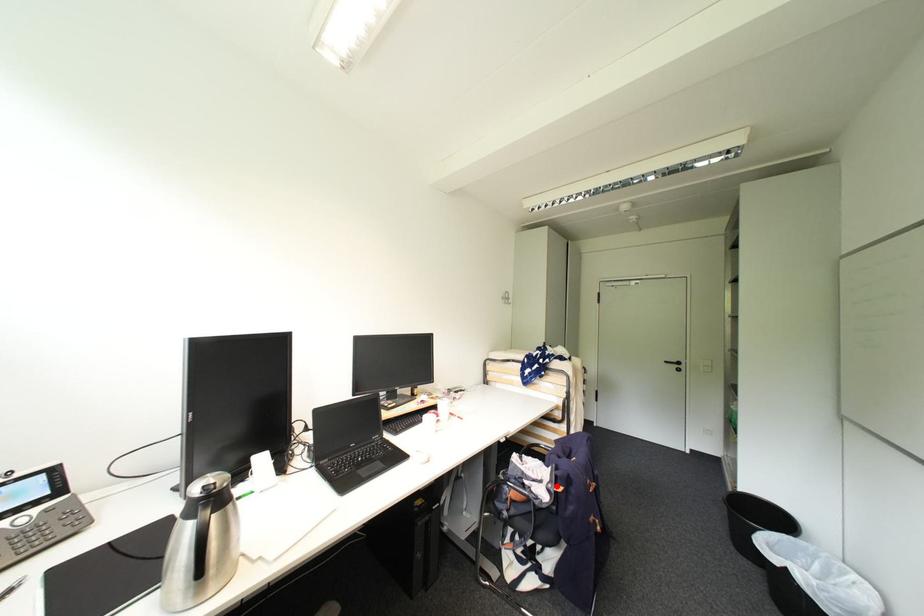
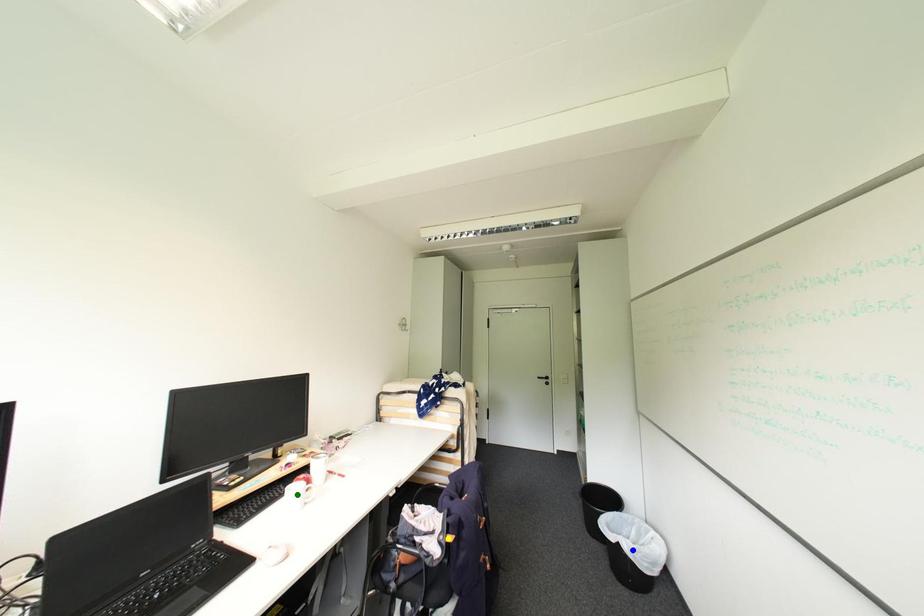
Question: I am providing you with two images of the same scene from different viewpoints. A red point is marked on the first image. You are given multiple points on the second image. Which spot in image 2 lines up with the point in image 1?

Choices:
 (A) blue point
 (B) yellow point
 (C) green point

Answer: (B)